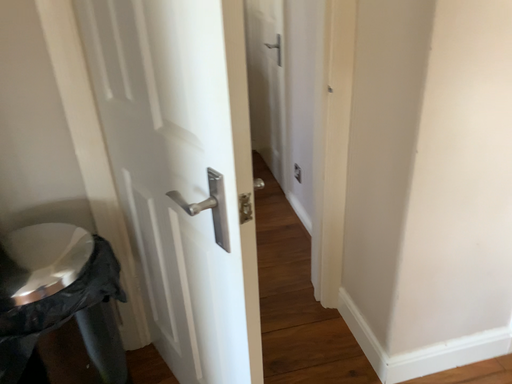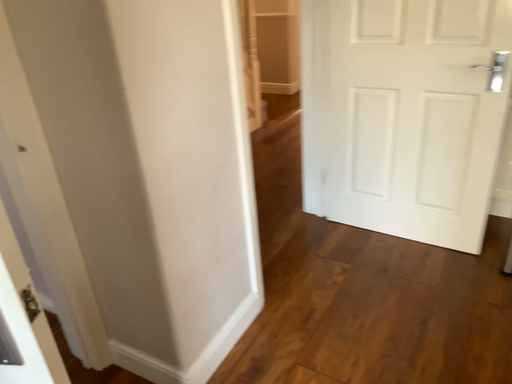
Question: How did the camera likely rotate when shooting the video?

Choices:
 (A) rotated left
 (B) rotated right

Answer: (B)